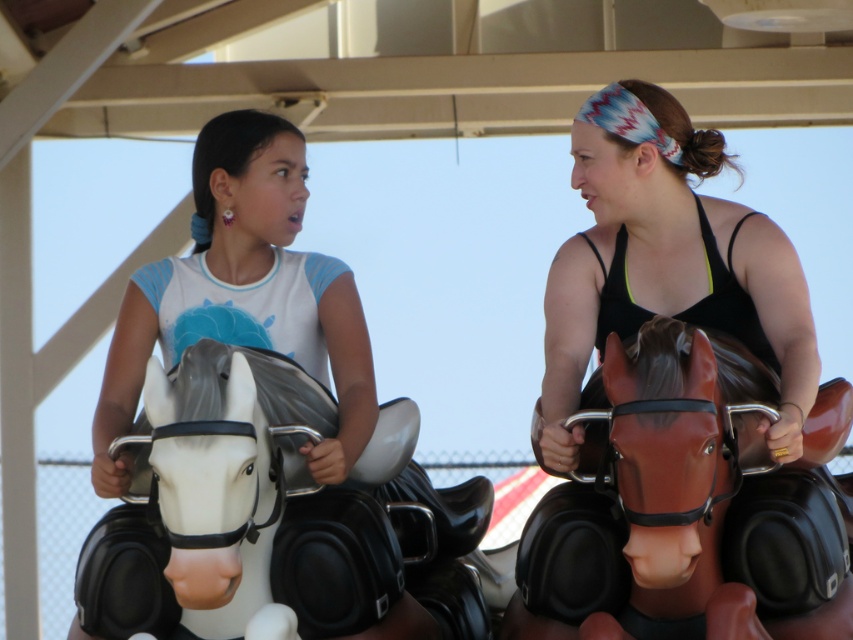
Who is lower down, matte black tank top at right or white glossy horse at left?

white glossy horse at left is below.

Image resolution: width=853 pixels, height=640 pixels. Describe the element at coordinates (666, 260) in the screenshot. I see `matte black tank top at right` at that location.

Between point (688, 154) and point (239, 282), which one is positioned behind?

The point (239, 282) is behind.

Identify the location of matte black tank top at right. This screenshot has width=853, height=640. (666, 260).

Who is higher up, shiny brown horse at right or white matte horse at left?

white matte horse at left is above.

Where is `shiny brown horse at right`? The image size is (853, 640). shiny brown horse at right is located at coordinates [x=686, y=504].

Does white matte horse at left appear on the left side of white glossy horse at left?

No, white matte horse at left is not to the left of white glossy horse at left.

Image resolution: width=853 pixels, height=640 pixels. Describe the element at coordinates (302, 502) in the screenshot. I see `white matte horse at left` at that location.

The width and height of the screenshot is (853, 640). In order to click on white matte horse at left in this screenshot , I will do `click(302, 502)`.